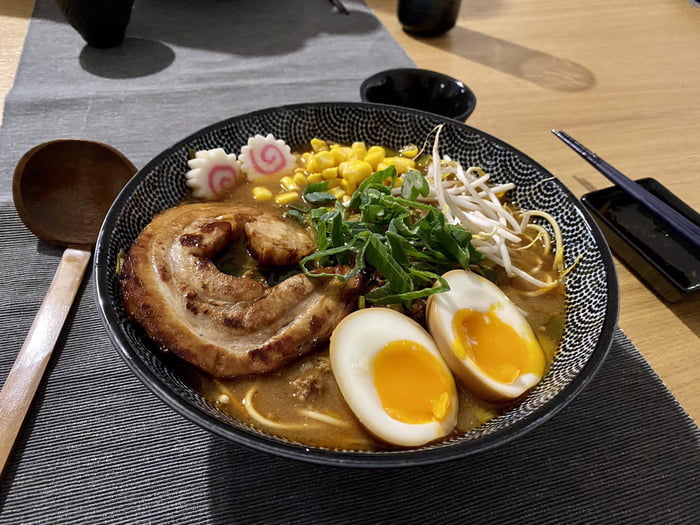
At what (x,y) coordinates should I click in order to perform the action: click on table. Please return your answer as a coordinate pair (x, y). This screenshot has height=525, width=700. Looking at the image, I should click on click(666, 86).